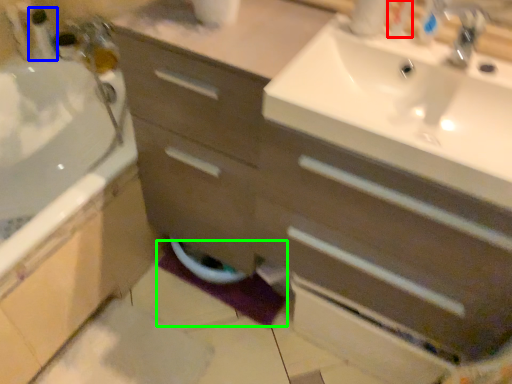
Question: Considering the real-world distances, which object is closest to toiletry (highlighted by a red box)? toiletry (highlighted by a blue box) or bath mat (highlighted by a green box).

Choices:
 (A) toiletry
 (B) bath mat

Answer: (B)